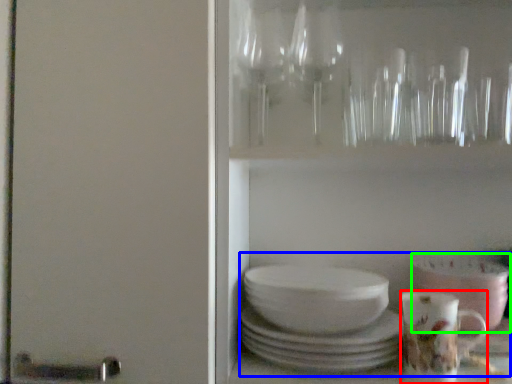
Question: Estimate the real-world distances between objects in this image. Which object is farther from coffee cup (highlighted by a red box), tea set (highlighted by a blue box) or bowl (highlighted by a green box)?

Choices:
 (A) tea set
 (B) bowl

Answer: (A)